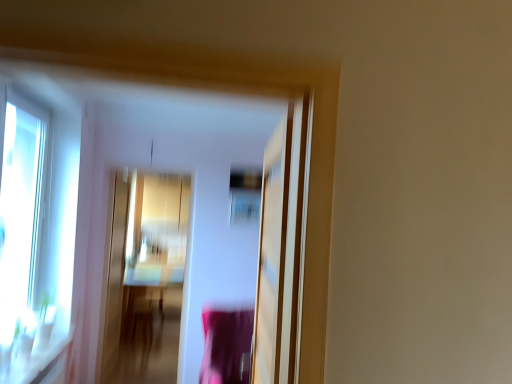
Question: Would you say transparent glass window at left is a long distance from wooden table at center?

Choices:
 (A) no
 (B) yes

Answer: (B)

Question: From a real-world perspective, is transparent glass window at left below wooden table at center?

Choices:
 (A) no
 (B) yes

Answer: (A)

Question: From the image's perspective, is transparent glass window at left on wooden table at center?

Choices:
 (A) no
 (B) yes

Answer: (B)

Question: Can you confirm if transparent glass window at left is wider than wooden table at center?

Choices:
 (A) yes
 (B) no

Answer: (B)

Question: Is transparent glass window at left taller than wooden table at center?

Choices:
 (A) no
 (B) yes

Answer: (B)

Question: From a real-world perspective, is transparent glass screen door at center, which is counted as the 1th screen door, starting from the right, above or below gold metallic screen door at center, the second screen door positioned from the right?

Choices:
 (A) below
 (B) above

Answer: (B)

Question: From the image's perspective, is transparent glass screen door at center, which appears as the 1th screen door when viewed from the front, above or below gold metallic screen door at center, the first screen door viewed from the back?

Choices:
 (A) above
 (B) below

Answer: (A)

Question: Looking at their shapes, would you say transparent glass screen door at center, which is counted as the 1th screen door, starting from the right, is wider or thinner than gold metallic screen door at center, which is the 1th screen door in left-to-right order?

Choices:
 (A) thin
 (B) wide

Answer: (B)

Question: Would you say transparent glass screen door at center, acting as the second screen door starting from the left, is to the left or to the right of gold metallic screen door at center, the first screen door viewed from the back, in the picture?

Choices:
 (A) left
 (B) right

Answer: (B)

Question: Visually, is transparent glass screen door at center, which is counted as the 1th screen door, starting from the right, positioned to the left or to the right of transparent glass window at left?

Choices:
 (A) right
 (B) left

Answer: (A)

Question: In terms of size, does transparent glass screen door at center, acting as the second screen door starting from the left, appear bigger or smaller than transparent glass window at left?

Choices:
 (A) small
 (B) big

Answer: (B)

Question: Is transparent glass screen door at center, which appears as the 1th screen door when viewed from the front, inside or outside of transparent glass window at left?

Choices:
 (A) outside
 (B) inside

Answer: (A)

Question: Is point (274, 231) closer or farther from the camera than point (7, 135)?

Choices:
 (A) closer
 (B) farther

Answer: (A)

Question: In terms of size, does transparent glass window at left appear bigger or smaller than transparent glass screen door at center, the second screen door positioned from the back?

Choices:
 (A) small
 (B) big

Answer: (A)

Question: In the image, is transparent glass window at left positioned in front of or behind transparent glass screen door at center, the second screen door positioned from the back?

Choices:
 (A) front
 (B) behind

Answer: (B)